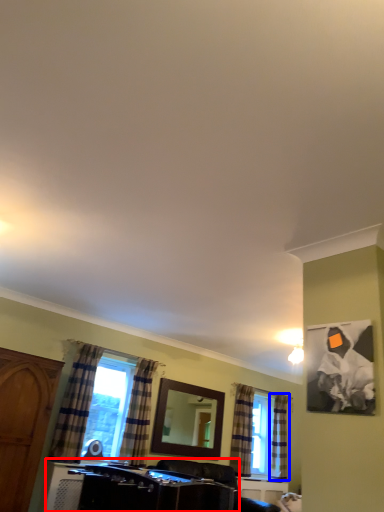
Question: Which object appears closest to the camera in this image, vanity (highlighted by a red box) or curtain (highlighted by a blue box)?

Choices:
 (A) vanity
 (B) curtain

Answer: (A)